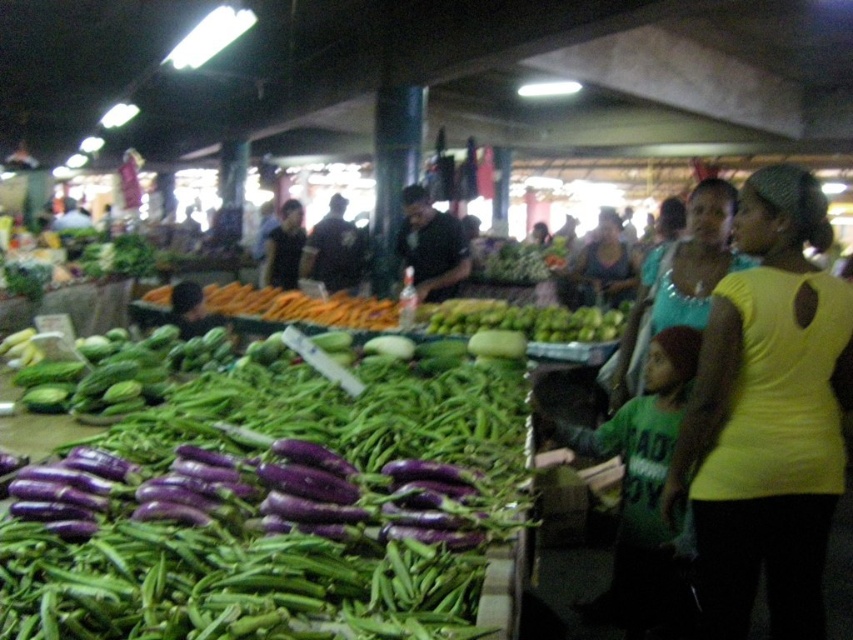
Which is above, purple glossy eggplant at center or yellow matte shirt at right?

yellow matte shirt at right is above.

Between purple glossy eggplant at center and yellow matte shirt at right, which one has less height?

purple glossy eggplant at center is shorter.

At what (x,y) coordinates should I click in order to perform the action: click on purple glossy eggplant at center. Please return your answer as a coordinate pair (x, y). The height and width of the screenshot is (640, 853). Looking at the image, I should click on (276, 512).

Image resolution: width=853 pixels, height=640 pixels. What are the coordinates of `purple glossy eggplant at center` in the screenshot? It's located at (x=276, y=512).

Is yellow matte shirt at right above teal fabric top at center?

No.

Is yellow matte shirt at right bigger than teal fabric top at center?

Actually, yellow matte shirt at right might be smaller than teal fabric top at center.

Identify the location of yellow matte shirt at right. (769, 417).

You are a GUI agent. You are given a task and a screenshot of the screen. Output one action in this format:
    pyautogui.click(x=<x>, y=<y>)
    Task: Click on the yellow matte shirt at right
    The height and width of the screenshot is (640, 853).
    Given the screenshot: What is the action you would take?
    pyautogui.click(x=769, y=417)

This screenshot has height=640, width=853. I want to click on purple glossy eggplant at center, so click(x=276, y=512).

Is purple glossy eggplant at center smaller than dark blue shirt at center?

Actually, purple glossy eggplant at center might be larger than dark blue shirt at center.

The width and height of the screenshot is (853, 640). Identify the location of purple glossy eggplant at center. (276, 512).

Locate an element on the screen. This screenshot has height=640, width=853. purple glossy eggplant at center is located at coordinates (276, 512).